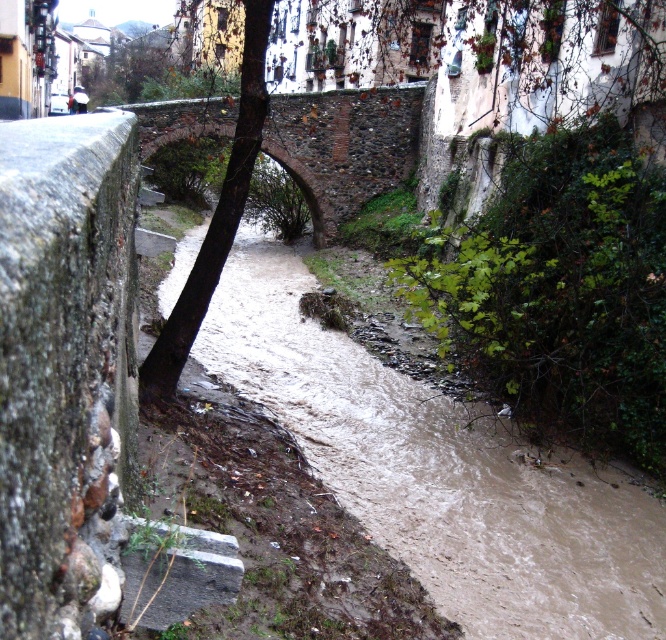
You are a delivery person carrying a large box that is 2 meters wide. You need to cross the stream shown in the scene. The stone arch bridge at center and the brown rough tree trunk at center are both potential paths. Which one can you use to cross the stream without your box getting stuck?

The stone arch bridge at center is wider than the brown rough tree trunk at center. Since your box is 2 meters wide, you should use the stone arch bridge at center as it can accommodate the width of your box, whereas the brown rough tree trunk at center is narrower and may cause the box to get stuck.

Based on the photo, you are standing at the point with coordinates (344, 147) in the image of the urban stream. What structure are you currently on?

The point with coordinates (344, 147) is located on the stone arch bridge at center, so you are currently on the stone arch bridge at center.

You are a delivery person trying to cross the stone arch bridge at center with a tall package. The package is 2 meters tall. The brown rough tree trunk at center is in the way. Can you pass under the tree trunk and cross the bridge without hitting the package on the trunk?

The stone arch bridge at center is shorter than the brown rough tree trunk at center. Since the package is 2 meters tall, and the bridge is shorter than the tree trunk, it means the bridge has a lower height clearance. Therefore, the package might hit the bridge structure before even reaching the tree trunk. You should not attempt to cross with the tall package as there is insufficient clearance under both the bridge and the tree trunk.